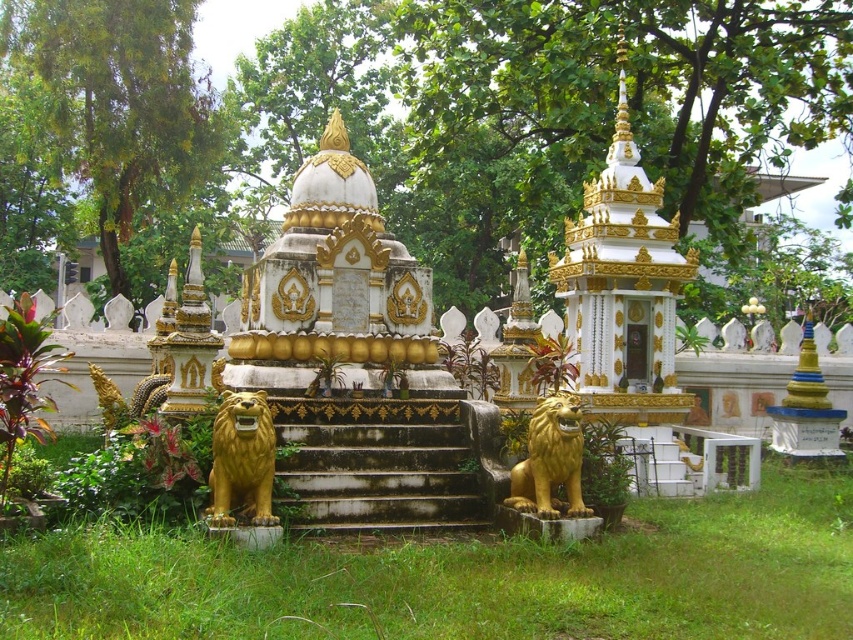
Is point (434, 420) more distant than point (569, 436)?

Yes, point (434, 420) is farther from viewer.

Does point (299, 445) come behind point (537, 472)?

Yes, it is.

This screenshot has height=640, width=853. In order to click on stone stairs at center in this screenshot , I will do `click(376, 474)`.

Between gold polished stone lion at lower left and gold polished lion at lower center, which one has more height?

Standing taller between the two is gold polished stone lion at lower left.

Which is more to the left, gold polished stone lion at lower left or gold polished lion at lower center?

From the viewer's perspective, gold polished stone lion at lower left appears more on the left side.

Describe the element at coordinates (241, 460) in the screenshot. I see `gold polished stone lion at lower left` at that location.

Find the location of a particular element. gold polished stone lion at lower left is located at coordinates (241, 460).

Who is positioned more to the left, stone stairs at center or gold polished stone lion at lower left?

gold polished stone lion at lower left

Does stone stairs at center have a lesser width compared to gold polished stone lion at lower left?

Yes, stone stairs at center is thinner than gold polished stone lion at lower left.

Which is behind, point (328, 452) or point (248, 518)?

The point (328, 452) is behind.

Where is `stone stairs at center`? Image resolution: width=853 pixels, height=640 pixels. stone stairs at center is located at coordinates (376, 474).